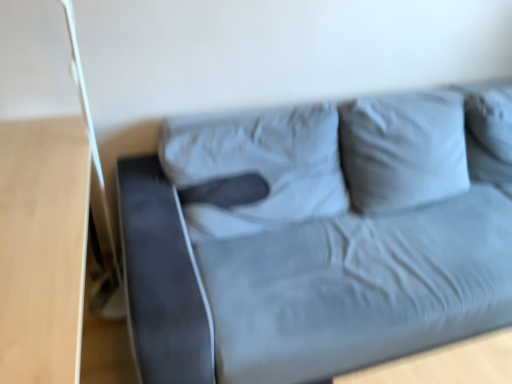
Question: Is suede gray couch at center taller or shorter than light wood table at left?

Choices:
 (A) tall
 (B) short

Answer: (A)

Question: Is suede gray couch at center situated inside light wood table at left or outside?

Choices:
 (A) outside
 (B) inside

Answer: (A)

Question: Considering the positions of suede gray couch at center and light wood table at left in the image, is suede gray couch at center wider or thinner than light wood table at left?

Choices:
 (A) wide
 (B) thin

Answer: (A)

Question: From the image's perspective, is light wood table at left positioned above or below suede gray couch at center?

Choices:
 (A) below
 (B) above

Answer: (A)

Question: Visually, is light wood table at left positioned to the left or to the right of suede gray couch at center?

Choices:
 (A) right
 (B) left

Answer: (B)

Question: Looking at their shapes, would you say light wood table at left is wider or thinner than suede gray couch at center?

Choices:
 (A) wide
 (B) thin

Answer: (B)

Question: Considering the positions of light wood table at left and suede gray couch at center in the image, is light wood table at left bigger or smaller than suede gray couch at center?

Choices:
 (A) small
 (B) big

Answer: (A)